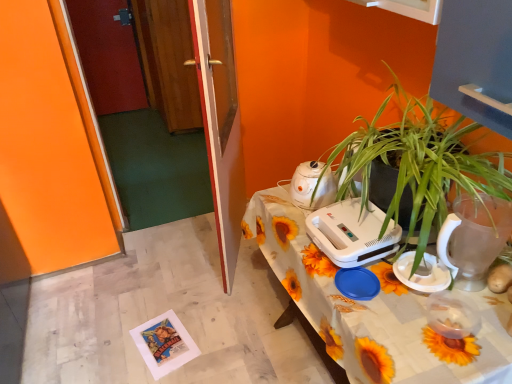
Identify the location of free space in front of white plastic appliance at upper right, the 2th appliance when ordered from back to front. (370, 299).